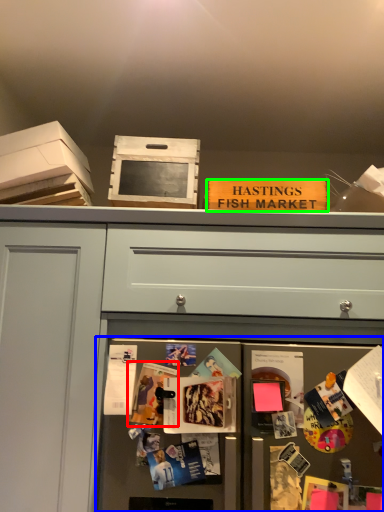
Question: Considering the real-world distances, which object is closest to magazine (highlighted by a red box)? fridge (highlighted by a blue box) or magazine (highlighted by a green box).

Choices:
 (A) fridge
 (B) magazine

Answer: (A)